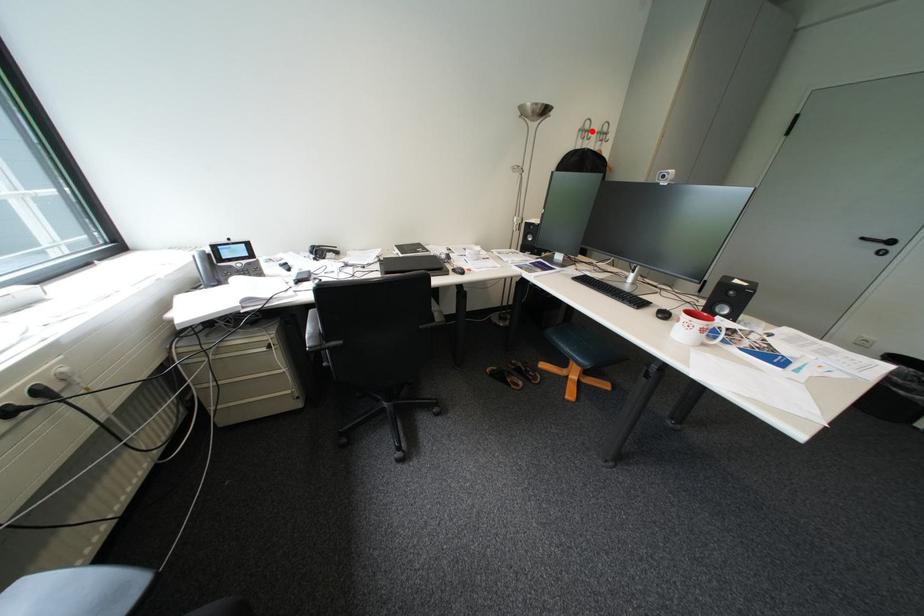
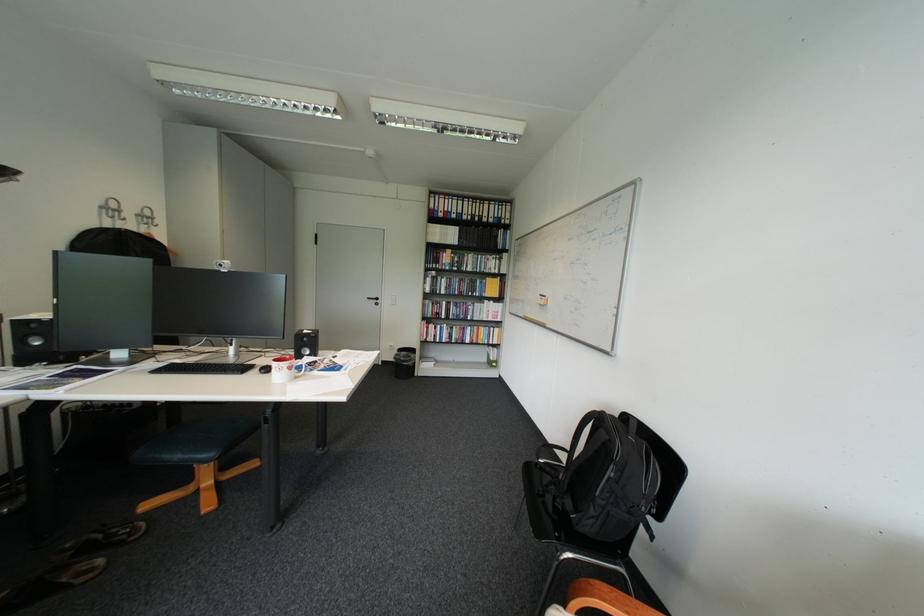
Question: A red point is marked in image1. In image2, is the corresponding 3D point closer to the camera or farther? Reply with the corresponding letter.

Choices:
 (A) The corresponding 3D point is closer.
 (B) The corresponding 3D point is farther.

Answer: (B)